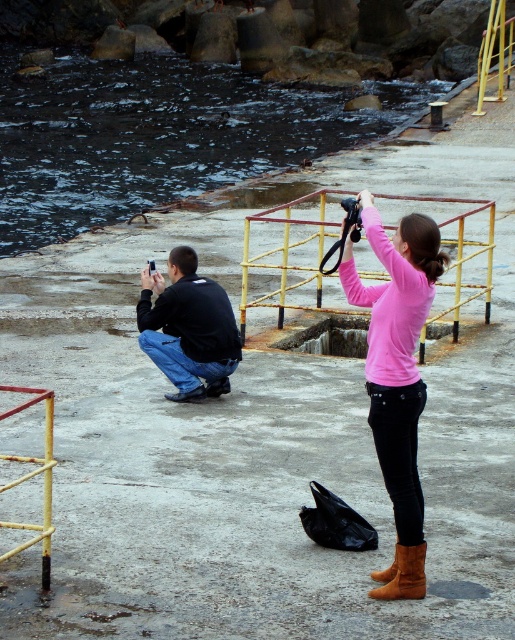
You are standing at the center of the waterfront area. You see the black matte jacket at lower left. Where is the black matte jacket located relative to your position?

The black matte jacket at lower left is located at point (187, 328) relative to the image frame.

You are a photographer trying to avoid stepping on the wet concrete. You notice the black matte jacket at lower left and the brown suede boot at lower center. Which object should you avoid stepping on to stay dry?

The brown suede boot at lower center is located below the black matte jacket at lower left, so stepping on the brown suede boot at lower center would keep you on the lower part of the concrete which is likely wetter. To stay dry, avoid stepping on the brown suede boot at lower center and instead step near the higher area where the black matte jacket at lower left is placed.